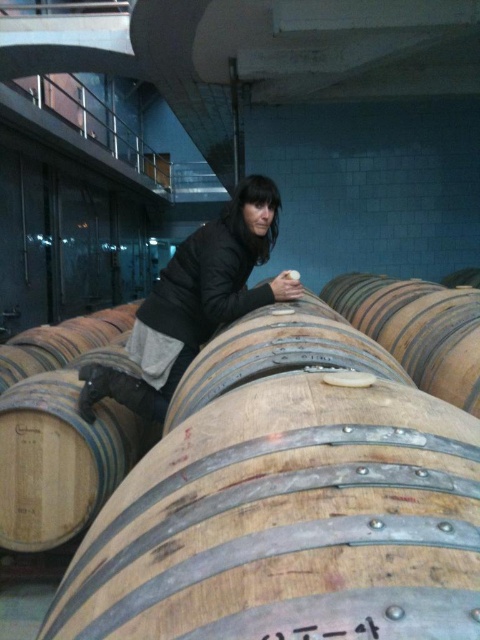
Which is below, brown wooden barrel at center or light brown wooden barrel at center?

Positioned lower is brown wooden barrel at center.

Describe the element at coordinates (288, 502) in the screenshot. The height and width of the screenshot is (640, 480). I see `brown wooden barrel at center` at that location.

Identify the location of brown wooden barrel at center. This screenshot has width=480, height=640. (288, 502).

Is dark gray jacket at center thinner than light brown wooden barrel at center?

No, dark gray jacket at center is not thinner than light brown wooden barrel at center.

Is dark gray jacket at center shorter than light brown wooden barrel at center?

No, dark gray jacket at center is not shorter than light brown wooden barrel at center.

Does point (235, 230) come in front of point (408, 352)?

Yes, it is in front of point (408, 352).

The height and width of the screenshot is (640, 480). Find the location of `dark gray jacket at center`. dark gray jacket at center is located at coordinates (194, 301).

Is brown wooden barrel at center taller than dark gray jacket at center?

No.

Does point (435, 496) come behind point (261, 296)?

That is False.

You are a GUI agent. You are given a task and a screenshot of the screen. Output one action in this format:
    pyautogui.click(x=<x>, y=<y>)
    Task: Click on the brown wooden barrel at center
    The width and height of the screenshot is (480, 640).
    Given the screenshot: What is the action you would take?
    pyautogui.click(x=288, y=502)